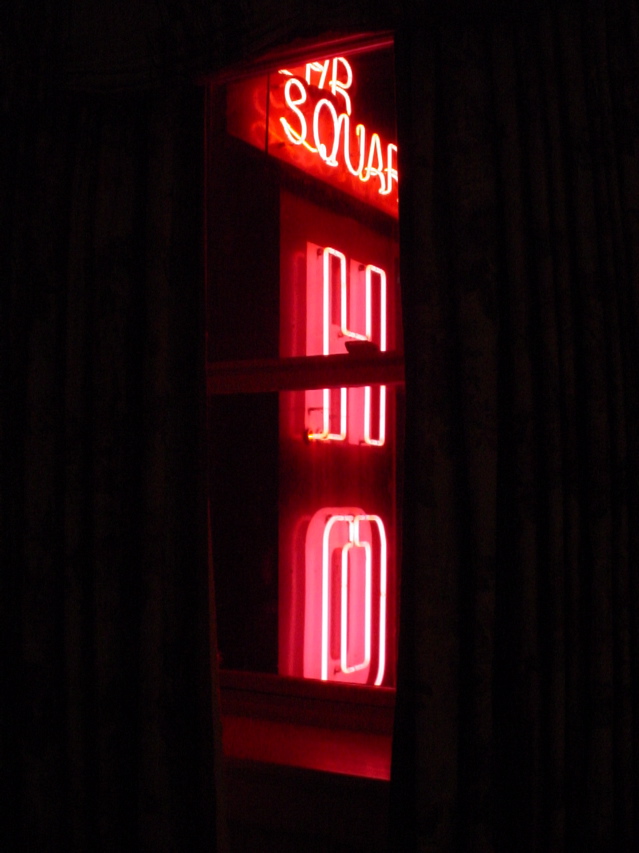
I want to click on curtains, so click(x=164, y=419), click(x=450, y=393).